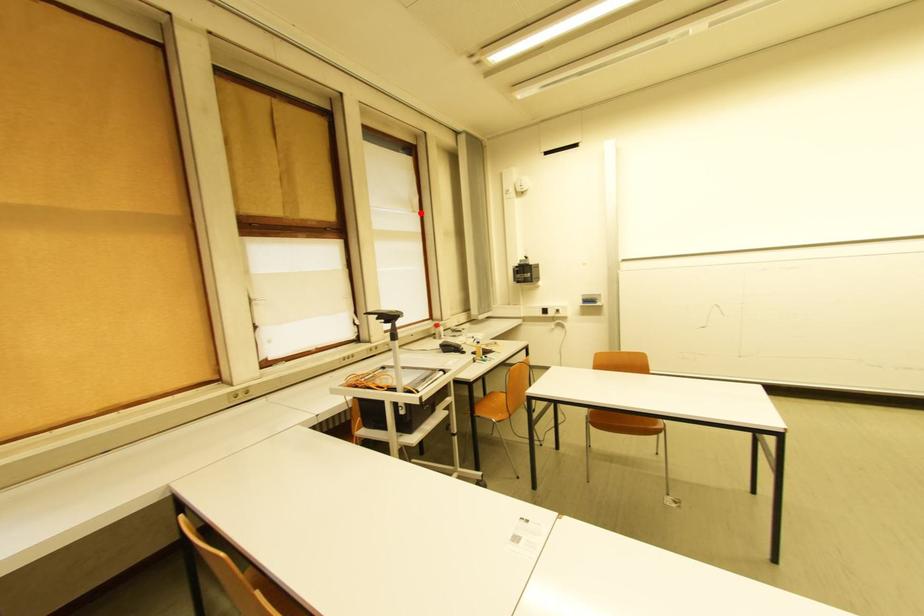
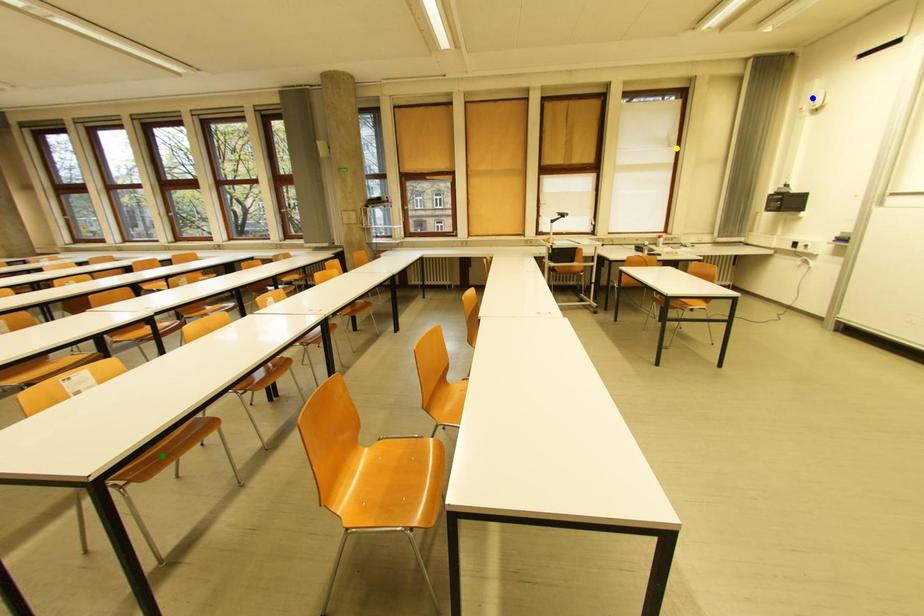
Question: I am providing you with two images of the same scene from different viewpoints. A red point is marked on the first image. You are given multiple points on the second image. Which spot in image 2 lines up with the point in image 1?

Choices:
 (A) yellow point
 (B) blue point
 (C) green point

Answer: (A)